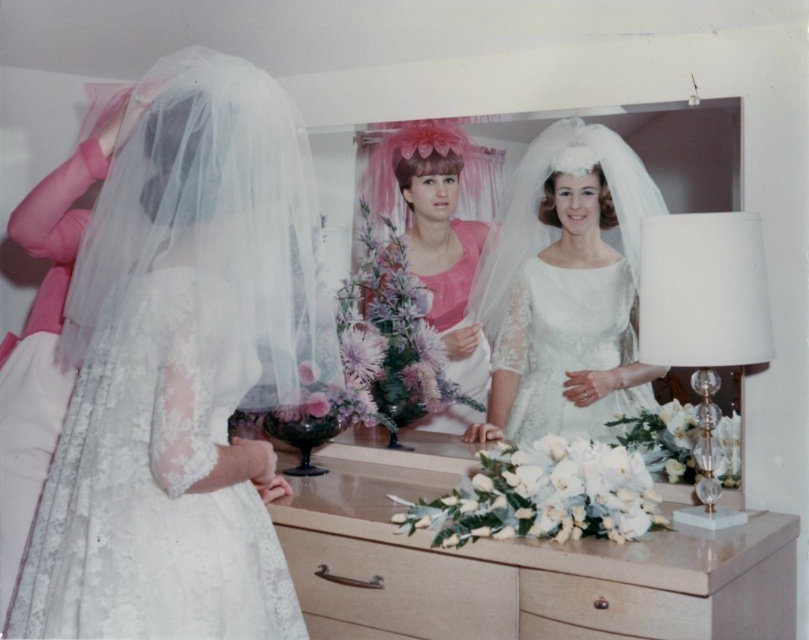
Is point (714, 328) more distant than point (693, 611)?

Yes, it is.

Is white glass lamp at right taller than light wood drawer at lower center?

Yes.

What do you see at coordinates (702, 321) in the screenshot? This screenshot has height=640, width=809. I see `white glass lamp at right` at bounding box center [702, 321].

You are a GUI agent. You are given a task and a screenshot of the screen. Output one action in this format:
    pyautogui.click(x=<x>, y=<y>)
    Task: Click on the white glass lamp at right
    The height and width of the screenshot is (640, 809).
    Given the screenshot: What is the action you would take?
    pyautogui.click(x=702, y=321)

Between white glass lamp at right and beige wood drawer at lower center, which one is positioned higher?

Positioned higher is white glass lamp at right.

Does white glass lamp at right come behind beige wood drawer at lower center?

No, white glass lamp at right is in front of beige wood drawer at lower center.

Locate an element on the screen. The image size is (809, 640). white glass lamp at right is located at coordinates (702, 321).

Looking at this image, can you confirm if lace fabric dress at center is thinner than wooden dresser at center?

Indeed, lace fabric dress at center has a lesser width compared to wooden dresser at center.

Identify the location of lace fabric dress at center. The width and height of the screenshot is (809, 640). (181, 369).

The height and width of the screenshot is (640, 809). What do you see at coordinates (181, 369) in the screenshot?
I see `lace fabric dress at center` at bounding box center [181, 369].

In order to click on lace fabric dress at center in this screenshot , I will do `click(181, 369)`.